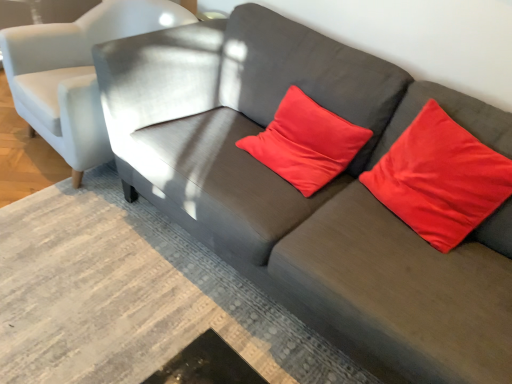
Question: From the image's perspective, is satin red pillow at upper right, acting as the first pillow starting from the right, on top of light gray fabric chair at upper left?

Choices:
 (A) yes
 (B) no

Answer: (B)

Question: Is satin red pillow at upper right, acting as the first pillow starting from the right, touching light gray fabric chair at upper left?

Choices:
 (A) yes
 (B) no

Answer: (B)

Question: Does satin red pillow at upper right, placed as the second pillow when sorted from left to right, turn towards light gray fabric chair at upper left?

Choices:
 (A) yes
 (B) no

Answer: (B)

Question: Does satin red pillow at upper right, placed as the second pillow when sorted from left to right, appear on the left side of light gray fabric chair at upper left?

Choices:
 (A) yes
 (B) no

Answer: (B)

Question: Is satin red pillow at upper right, placed as the second pillow when sorted from left to right, positioned with its back to light gray fabric chair at upper left?

Choices:
 (A) yes
 (B) no

Answer: (B)

Question: Visually, is light gray fabric chair at upper left positioned to the left or to the right of satin red pillow at upper right, acting as the first pillow starting from the right?

Choices:
 (A) right
 (B) left

Answer: (B)

Question: Is light gray fabric chair at upper left bigger or smaller than satin red pillow at upper right, acting as the first pillow starting from the right?

Choices:
 (A) small
 (B) big

Answer: (B)

Question: Is light gray fabric chair at upper left spatially inside satin red pillow at upper right, acting as the first pillow starting from the right, or outside of it?

Choices:
 (A) outside
 (B) inside

Answer: (A)

Question: Is light gray fabric chair at upper left taller or shorter than satin red pillow at upper right, placed as the second pillow when sorted from left to right?

Choices:
 (A) short
 (B) tall

Answer: (B)

Question: Considering the positions of light gray fabric chair at upper left and satin red pillow at center, which is the first pillow from left to right, in the image, is light gray fabric chair at upper left bigger or smaller than satin red pillow at center, which is the first pillow from left to right,?

Choices:
 (A) small
 (B) big

Answer: (B)

Question: Do you think light gray fabric chair at upper left is within satin red pillow at center, placed as the 2th pillow when sorted from right to left, or outside of it?

Choices:
 (A) outside
 (B) inside

Answer: (A)

Question: Considering their positions, is light gray fabric chair at upper left located in front of or behind satin red pillow at center, placed as the 2th pillow when sorted from right to left?

Choices:
 (A) behind
 (B) front

Answer: (A)

Question: Considering the positions of light gray fabric chair at upper left and satin red pillow at center, placed as the 2th pillow when sorted from right to left, in the image, is light gray fabric chair at upper left wider or thinner than satin red pillow at center, placed as the 2th pillow when sorted from right to left,?

Choices:
 (A) wide
 (B) thin

Answer: (A)

Question: From their relative heights in the image, would you say satin red pillow at upper right, acting as the first pillow starting from the right, is taller or shorter than satin red pillow at center, placed as the 2th pillow when sorted from right to left?

Choices:
 (A) tall
 (B) short

Answer: (A)

Question: From the image's perspective, is satin red pillow at upper right, placed as the second pillow when sorted from left to right, positioned above or below satin red pillow at center, which is the first pillow from left to right?

Choices:
 (A) above
 (B) below

Answer: (B)